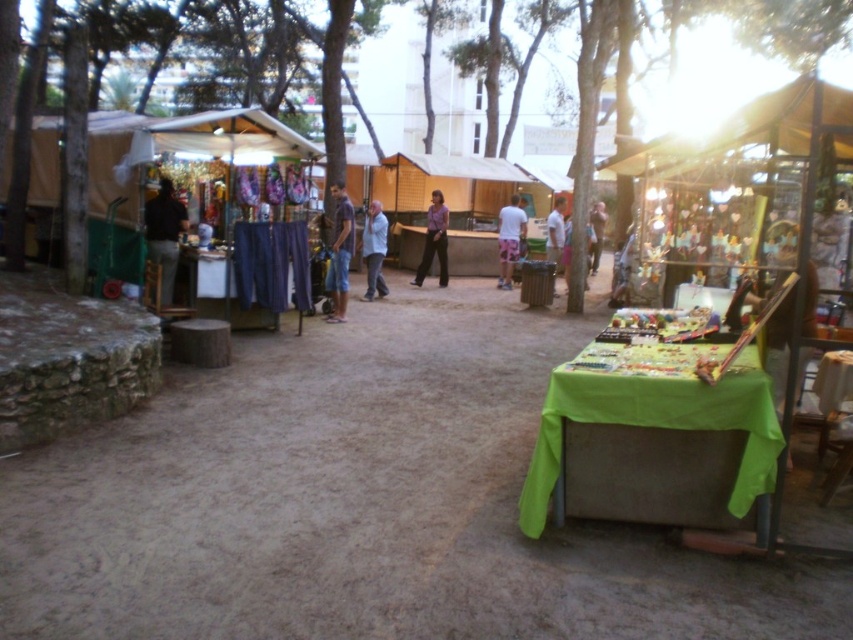
Question: Observing the image, what is the correct spatial positioning of denim shorts at center in reference to white fabric shirt at center?

Choices:
 (A) left
 (B) right

Answer: (A)

Question: Which object is closer to the camera taking this photo?

Choices:
 (A) purple fabric pants at center
 (B) light brown leather jacket at center
 (C) denim shorts at center

Answer: (C)

Question: From the image, what is the correct spatial relationship of dark brown leather jacket at left in relation to purple fabric pants at center?

Choices:
 (A) below
 (B) above

Answer: (A)

Question: Which of the following is the farthest from the observer?

Choices:
 (A) (729, 387)
 (B) (548, 240)
 (C) (598, 209)
 (D) (523, 232)

Answer: (C)

Question: Among these points, which one is nearest to the camera?

Choices:
 (A) (547, 221)
 (B) (380, 278)
 (C) (329, 278)

Answer: (C)

Question: Is dark brown leather jacket at left above white fabric shirt at center?

Choices:
 (A) yes
 (B) no

Answer: (B)